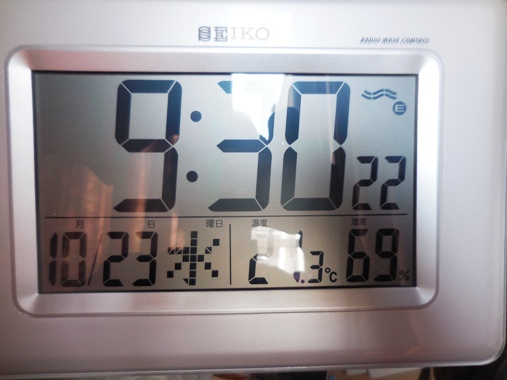
Find the location of a particular element. The image size is (507, 380). thermometer is located at coordinates (114, 153).